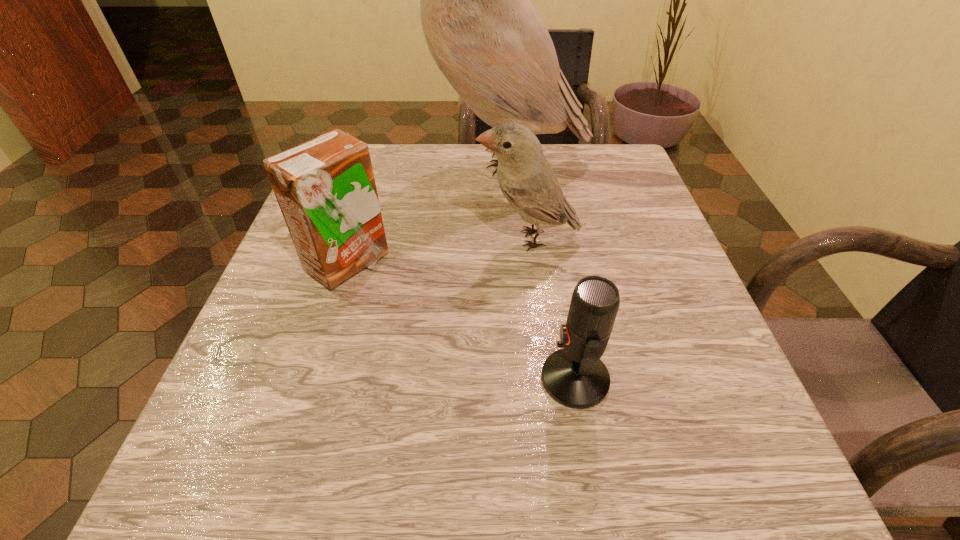
Where is `parakeet`? The height and width of the screenshot is (540, 960). parakeet is located at coordinates (486, 37).

This screenshot has width=960, height=540. Identify the location of the farthest object. click(x=486, y=37).

Where is `bird`? bird is located at coordinates (526, 178).

Locate an element on the screen. The height and width of the screenshot is (540, 960). carton is located at coordinates (325, 187).

This screenshot has width=960, height=540. What are the coordinates of `the nearest object` in the screenshot? It's located at (574, 376).

Identify the location of the shortest object. The image size is (960, 540). (574, 376).

Locate an element on the screen. Image resolution: width=960 pixels, height=540 pixels. free space located on the face of the farthest object is located at coordinates (363, 159).

At what (x,y) coordinates should I click in order to perform the action: click on free region located 0.090m on the face of the farthest object. Please return your answer as a coordinate pair (x, y). This screenshot has width=960, height=540. Looking at the image, I should click on (372, 159).

Where is `vacant space situated 0.170m on the face of the farthest object`? Image resolution: width=960 pixels, height=540 pixels. vacant space situated 0.170m on the face of the farthest object is located at coordinates (338, 159).

The width and height of the screenshot is (960, 540). What are the coordinates of `free region located 0.120m at the face of the bird` in the screenshot? It's located at (414, 239).